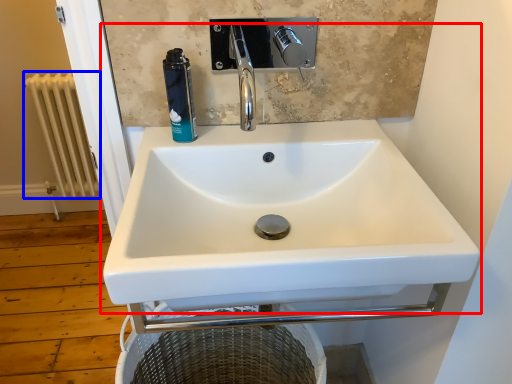
Question: Which point is further to the camera, sink (highlighted by a red box) or radiator (highlighted by a blue box)?

Choices:
 (A) sink
 (B) radiator

Answer: (B)